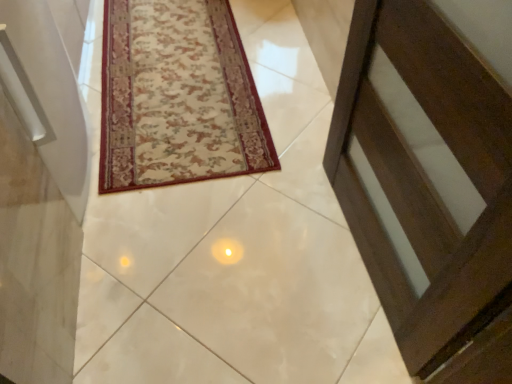
Question: Based on their positions, is white glossy tile at center located to the left or right of beige floral rug at center?

Choices:
 (A) right
 (B) left

Answer: (A)

Question: Is white glossy tile at center in front of or behind beige floral rug at center in the image?

Choices:
 (A) behind
 (B) front

Answer: (B)

Question: From a real-world perspective, is white glossy tile at center positioned above or below beige floral rug at center?

Choices:
 (A) above
 (B) below

Answer: (B)

Question: From the image's perspective, is beige floral rug at center located above or below white glossy tile at center?

Choices:
 (A) above
 (B) below

Answer: (A)

Question: Based on their sizes in the image, would you say beige floral rug at center is bigger or smaller than white glossy tile at center?

Choices:
 (A) small
 (B) big

Answer: (A)

Question: Is point (153, 77) positioned closer to the camera than point (233, 180)?

Choices:
 (A) farther
 (B) closer

Answer: (A)

Question: Is beige floral rug at center wider or thinner than white glossy tile at center?

Choices:
 (A) thin
 (B) wide

Answer: (A)